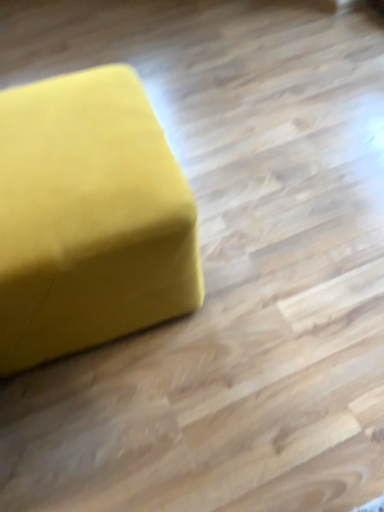
Describe the element at coordinates (89, 217) in the screenshot. The image size is (384, 512). I see `matte yellow ottoman at left` at that location.

The image size is (384, 512). I want to click on matte yellow ottoman at left, so click(89, 217).

Find the location of a particular element. matte yellow ottoman at left is located at coordinates (89, 217).